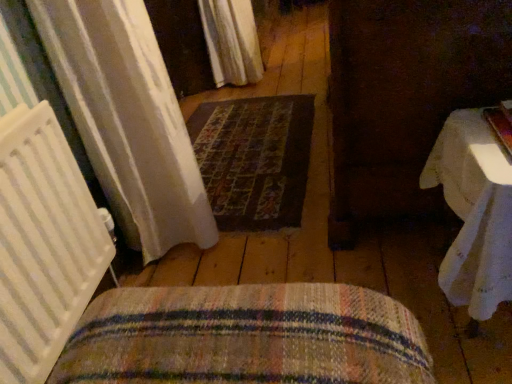
Question: Is woven fabric cushion at lower center positioned with its back to white cloth-covered table at right?

Choices:
 (A) yes
 (B) no

Answer: (B)

Question: Is woven fabric cushion at lower center not near white cloth-covered table at right?

Choices:
 (A) yes
 (B) no

Answer: (B)

Question: Can you confirm if woven fabric cushion at lower center is smaller than white cloth-covered table at right?

Choices:
 (A) yes
 (B) no

Answer: (B)

Question: From a real-world perspective, does woven fabric cushion at lower center stand above white cloth-covered table at right?

Choices:
 (A) yes
 (B) no

Answer: (A)

Question: Can you confirm if woven fabric cushion at lower center is taller than white cloth-covered table at right?

Choices:
 (A) no
 (B) yes

Answer: (A)

Question: Considering the relative sizes of woven fabric cushion at lower center and white cloth-covered table at right in the image provided, is woven fabric cushion at lower center thinner than white cloth-covered table at right?

Choices:
 (A) no
 (B) yes

Answer: (A)

Question: Can you confirm if white cloth-covered table at right is smaller than dark brown woven mat at center?

Choices:
 (A) yes
 (B) no

Answer: (B)

Question: Is white cloth-covered table at right outside dark brown woven mat at center?

Choices:
 (A) no
 (B) yes

Answer: (B)

Question: Is the depth of white cloth-covered table at right greater than that of dark brown woven mat at center?

Choices:
 (A) no
 (B) yes

Answer: (A)

Question: Does white cloth-covered table at right turn towards dark brown woven mat at center?

Choices:
 (A) yes
 (B) no

Answer: (B)

Question: Can you confirm if white cloth-covered table at right is thinner than dark brown woven mat at center?

Choices:
 (A) yes
 (B) no

Answer: (A)

Question: Does white cloth-covered table at right have a greater width compared to dark brown woven mat at center?

Choices:
 (A) no
 (B) yes

Answer: (A)

Question: Considering the relative sizes of woven fabric cushion at lower center and white sheer curtain at upper center in the image provided, is woven fabric cushion at lower center smaller than white sheer curtain at upper center?

Choices:
 (A) yes
 (B) no

Answer: (A)